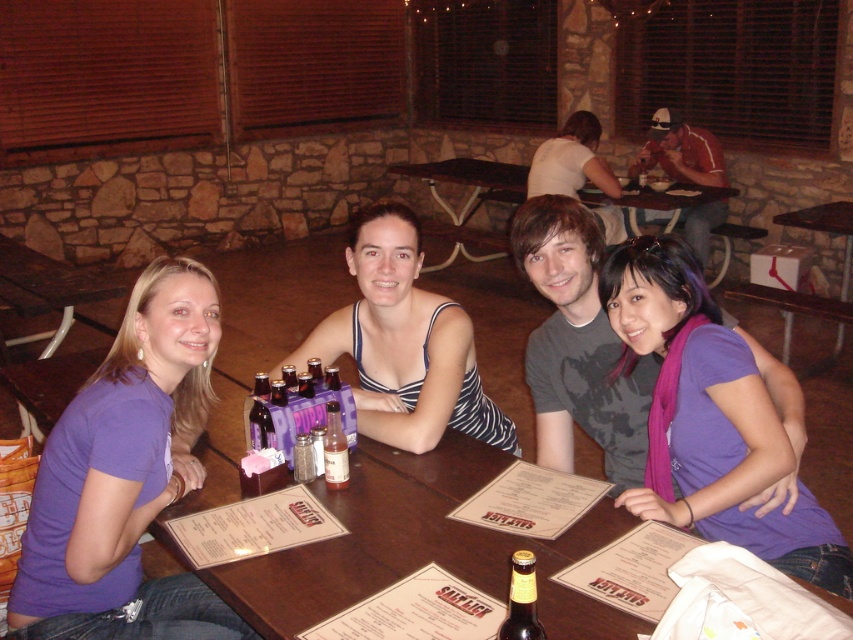
You are a server at the restaurant and need to deliver a drink to the customer wearing the purple cotton shirt at center. The drink is in the brown glass bottle at table center. Can you place the drink directly on the table without moving the shirt?

The purple cotton shirt at center is located above the brown glass bottle at table center, so you cannot place the drink directly on the table without moving the shirt.

You are a photographer taking a group photo of the purple cotton shirt at center and the striped fabric tank top at center. Which clothing item should you focus on first if you want to capture both in the same frame without moving the camera?

The purple cotton shirt at center is taller than the striped fabric tank top at center, so you should focus on the purple cotton shirt at center first to ensure both are in frame.

You are a photographer taking a photo of the group at the wooden table. You want to ensure both the purple cotton shirt at center and the striped fabric tank top at center are clearly visible. Which clothing item is positioned lower on the person, potentially requiring you to adjust your camera angle to capture both?

The purple cotton shirt at center is below the striped fabric tank top at center, so you may need to adjust your camera angle to ensure both are visible.